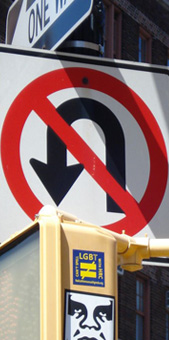
Image resolution: width=169 pixels, height=340 pixels. Find the location of `yellow light box`. yellow light box is located at coordinates (77, 238).